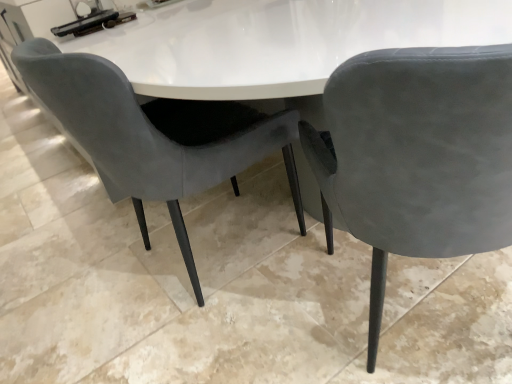
Question: Considering the positions of suede gray chair at center, acting as the 1th chair starting from the left, and suede gray chair at center, which ranks as the second chair in left-to-right order, in the image, is suede gray chair at center, acting as the 1th chair starting from the left, taller or shorter than suede gray chair at center, which ranks as the second chair in left-to-right order,?

Choices:
 (A) tall
 (B) short

Answer: (B)

Question: Choose the correct answer: Is suede gray chair at center, acting as the 1th chair starting from the left, inside suede gray chair at center, the first chair when ordered from right to left, or outside it?

Choices:
 (A) inside
 (B) outside

Answer: (B)

Question: In terms of size, does suede gray chair at center, acting as the 1th chair starting from the left, appear bigger or smaller than suede gray chair at center, which ranks as the second chair in left-to-right order?

Choices:
 (A) small
 (B) big

Answer: (B)

Question: In terms of width, does suede gray chair at center, the first chair when ordered from right to left, look wider or thinner when compared to suede gray chair at center, which is the 2th chair from right to left?

Choices:
 (A) thin
 (B) wide

Answer: (B)

Question: From a real-world perspective, relative to suede gray chair at center, acting as the 1th chair starting from the left, is suede gray chair at center, the first chair when ordered from right to left, vertically above or below?

Choices:
 (A) below
 (B) above

Answer: (A)

Question: Considering the positions of suede gray chair at center, the first chair when ordered from right to left, and suede gray chair at center, acting as the 1th chair starting from the left, in the image, is suede gray chair at center, the first chair when ordered from right to left, taller or shorter than suede gray chair at center, acting as the 1th chair starting from the left,?

Choices:
 (A) tall
 (B) short

Answer: (A)

Question: Is suede gray chair at center, which ranks as the second chair in left-to-right order, in front of or behind suede gray chair at center, which is the 2th chair from right to left, in the image?

Choices:
 (A) front
 (B) behind

Answer: (A)